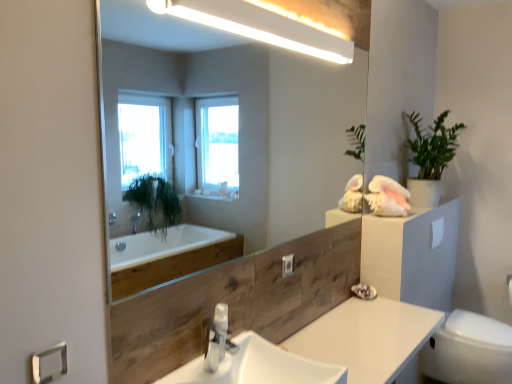
Question: Can you confirm if white glossy light fixture at upper center is thinner than transparent glass mirror at upper center?

Choices:
 (A) no
 (B) yes

Answer: (A)

Question: Is white glossy light fixture at upper center behind transparent glass mirror at upper center?

Choices:
 (A) no
 (B) yes

Answer: (B)

Question: Is white glossy light fixture at upper center in contact with transparent glass mirror at upper center?

Choices:
 (A) no
 (B) yes

Answer: (A)

Question: Is white glossy light fixture at upper center wider than transparent glass mirror at upper center?

Choices:
 (A) no
 (B) yes

Answer: (B)

Question: Is white glossy light fixture at upper center oriented towards transparent glass mirror at upper center?

Choices:
 (A) no
 (B) yes

Answer: (A)

Question: From the image's perspective, does white glossy light fixture at upper center appear lower than transparent glass mirror at upper center?

Choices:
 (A) yes
 (B) no

Answer: (B)

Question: Can you confirm if green matte plant at upper right is shorter than satin nickel faucet at center?

Choices:
 (A) no
 (B) yes

Answer: (A)

Question: Would you say green matte plant at upper right is outside satin nickel faucet at center?

Choices:
 (A) no
 (B) yes

Answer: (B)

Question: Does green matte plant at upper right appear on the left side of satin nickel faucet at center?

Choices:
 (A) yes
 (B) no

Answer: (B)

Question: Is satin nickel faucet at center completely or partially inside green matte plant at upper right?

Choices:
 (A) no
 (B) yes

Answer: (A)

Question: Are green matte plant at upper right and satin nickel faucet at center far apart?

Choices:
 (A) no
 (B) yes

Answer: (B)

Question: From the image's perspective, is green matte plant at upper right located above satin nickel faucet at center?

Choices:
 (A) no
 (B) yes

Answer: (B)

Question: Considering the relative positions of white glossy light fixture at upper center and white glossy toilet bowl at lower right in the image provided, is white glossy light fixture at upper center behind white glossy toilet bowl at lower right?

Choices:
 (A) yes
 (B) no

Answer: (B)